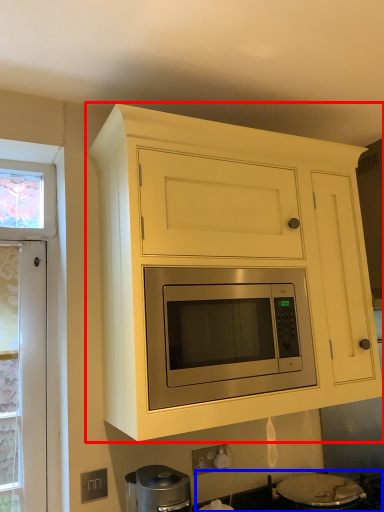
Question: Which of the following is the closest to the observer, cabinetry (highlighted by a red box) or gas stove (highlighted by a blue box)?

Choices:
 (A) cabinetry
 (B) gas stove

Answer: (A)